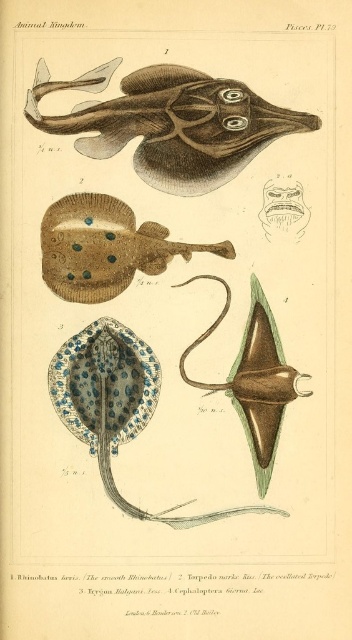
You are examining the illustration of the ray in the top left corner. There are two points marked on the ray, one at coordinates point (x=74, y=80) and another at point (x=103, y=221). Which point is closer to you?

Point (x=74, y=80) is closer to you because it is further to the camera than point (x=103, y=221).

You are a researcher examining the illustration titled Pl. 79 from the scientific publication. You need to locate the brown textured ray at upper center and the orange spotted fish at lower right. Which of these two fish is positioned closer to the top edge of the illustration?

The brown textured ray at upper center is positioned closer to the top edge of the illustration compared to the orange spotted fish at lower right, as it is located at point 0.192 on the y axis versus the orange spotted fish at lower right at 0.821 on the y axis.